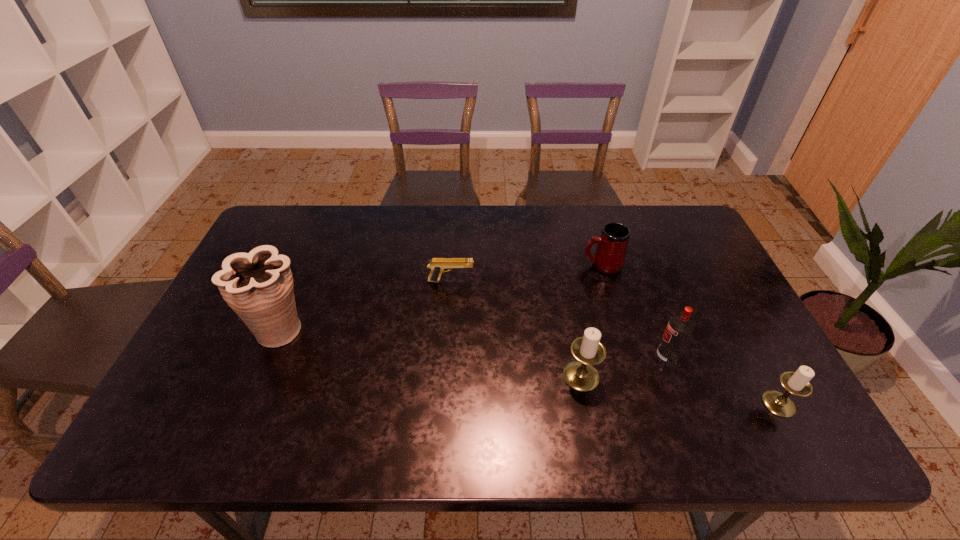
This screenshot has height=540, width=960. I want to click on vacant space in between the vodka and the tallest object, so click(x=473, y=343).

Identify the location of free space that is in between the fourth object from right to left and the third object from right to left. The width and height of the screenshot is (960, 540). point(591,320).

The image size is (960, 540). Identify the location of vacant area between the taller candle holder and the second object from right to left. (624, 367).

Locate an element on the screen. free space between the taller candle holder and the vodka is located at coordinates (624, 367).

Locate an element on the screen. free space between the taller candle holder and the leftmost object is located at coordinates (431, 353).

You are a GUI agent. You are given a task and a screenshot of the screen. Output one action in this format:
    pyautogui.click(x=<x>, y=<y>)
    Task: Click on the free area in between the rightmost object and the second farthest object
    This screenshot has height=540, width=960.
    Given the screenshot: What is the action you would take?
    pyautogui.click(x=615, y=342)

This screenshot has width=960, height=540. What are the coordinates of `empty location between the farthest object and the fifth nearest object` in the screenshot? It's located at (527, 273).

At what (x,y) coordinates should I click in order to perform the action: click on vacant area between the mug and the shortest object. Please return your answer as a coordinate pair (x, y). The width and height of the screenshot is (960, 540). Looking at the image, I should click on (527, 273).

Locate an element on the screen. free space between the fifth object from right to left and the taller candle holder is located at coordinates (516, 328).

You are a GUI agent. You are given a task and a screenshot of the screen. Output one action in this format:
    pyautogui.click(x=<x>, y=<y>)
    Task: Click on the fourth closest object to the urn
    The image size is (960, 540).
    Given the screenshot: What is the action you would take?
    pyautogui.click(x=679, y=328)